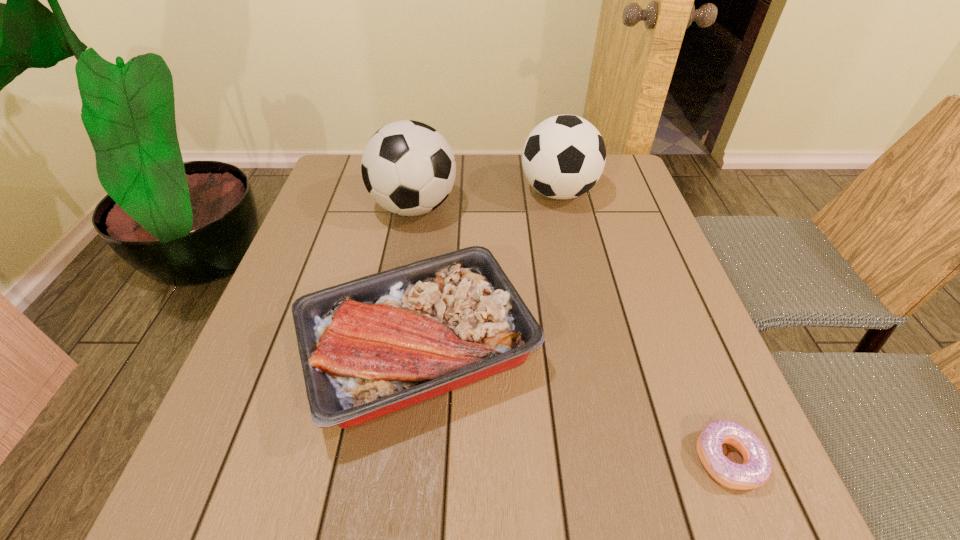
You are a GUI agent. You are given a task and a screenshot of the screen. Output one action in this format:
    pyautogui.click(x=<x>, y=<y>)
    Task: Click on the free space between the doughnut and the second shortest object
    Image resolution: width=960 pixels, height=540 pixels.
    Given the screenshot: What is the action you would take?
    pyautogui.click(x=573, y=405)

Locate an element on the screen. The height and width of the screenshot is (540, 960). free point between the left soccer ball and the right soccer ball is located at coordinates (486, 200).

Image resolution: width=960 pixels, height=540 pixels. In order to click on the second closest object to the right soccer ball in this screenshot , I will do `click(369, 347)`.

Identify which object is the second nearest to the left soccer ball. Please provide its 2D coordinates. Your answer should be formatted as a tuple, i.e. [(x, y)], where the tuple contains the x and y coordinates of a point satisfying the conditions above.

[(564, 156)]

Image resolution: width=960 pixels, height=540 pixels. Identify the location of vacant space that satisfies the following two spatial constraints: 1. on the front side of the left soccer ball; 2. on the right side of the tray. (389, 351).